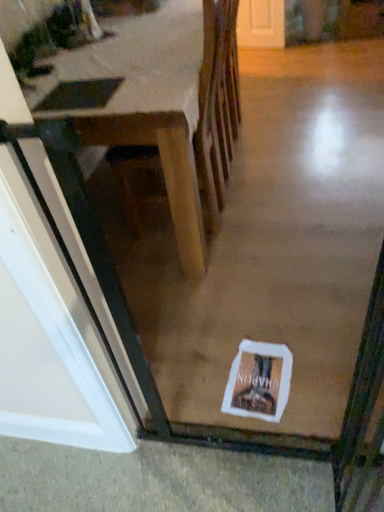
Question: Considering the positions of point (256, 346) and point (215, 187), is point (256, 346) closer or farther from the camera than point (215, 187)?

Choices:
 (A) farther
 (B) closer

Answer: (B)

Question: From the image's perspective, relative to wooden table at center, is white paper postcard at center above or below?

Choices:
 (A) above
 (B) below

Answer: (B)

Question: From a real-world perspective, relative to wooden table at center, is white paper postcard at center vertically above or below?

Choices:
 (A) above
 (B) below

Answer: (B)

Question: From a real-world perspective, is wooden table at center positioned above or below white paper postcard at center?

Choices:
 (A) above
 (B) below

Answer: (A)

Question: From the image's perspective, is wooden table at center located above or below white paper postcard at center?

Choices:
 (A) above
 (B) below

Answer: (A)

Question: Considering the positions of wooden table at center and white paper postcard at center in the image, is wooden table at center bigger or smaller than white paper postcard at center?

Choices:
 (A) big
 (B) small

Answer: (A)

Question: In the image, is wooden table at center on the left side or the right side of white paper postcard at center?

Choices:
 (A) right
 (B) left

Answer: (B)